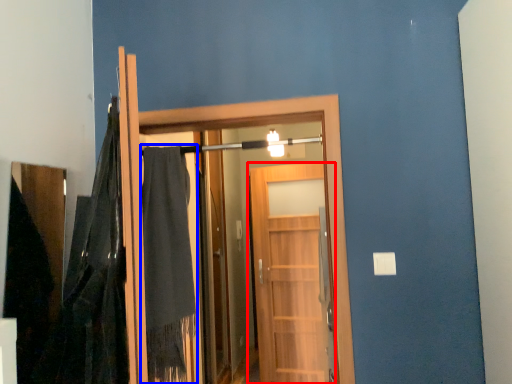
Question: Which of the following is the farthest to the observer, door (highlighted by a red box) or robe (highlighted by a blue box)?

Choices:
 (A) door
 (B) robe

Answer: (A)